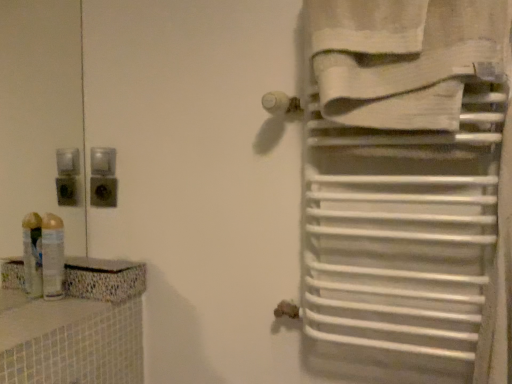
What do you see at coordinates (53, 256) in the screenshot?
I see `translucent plastic spray can at left` at bounding box center [53, 256].

Where is `white cotton towel at upper right`? white cotton towel at upper right is located at coordinates (401, 58).

Is translucent plastic spray can at left turned away from black plastic outlet at upper left?

No.

From a real-world perspective, is translucent plastic spray can at left positioned above or below black plastic outlet at upper left?

In terms of real-world spatial position, translucent plastic spray can at left is below black plastic outlet at upper left.

From the image's perspective, does translucent plastic spray can at left appear higher than black plastic outlet at upper left?

No, from the image's perspective, translucent plastic spray can at left is not over black plastic outlet at upper left.

From the image's perspective, is white cotton towel at upper right located above or below black plastic outlet at upper left?

Based on their image positions, white cotton towel at upper right is located above black plastic outlet at upper left.

Which is behind, white cotton towel at upper right or black plastic outlet at upper left?

black plastic outlet at upper left is further away from the camera.

What's the angular difference between white cotton towel at upper right and black plastic outlet at upper left's facing directions?

They differ by 0.102 degrees in their facing directions.

Looking at their sizes, would you say white cotton towel at upper right is wider or thinner than black plastic outlet at upper left?

Considering their sizes, white cotton towel at upper right looks broader than black plastic outlet at upper left.

Which is behind, point (112, 183) or point (63, 253)?

The point (112, 183) is farther from the camera.

From the image's perspective, is black plastic outlet at upper left beneath translucent plastic spray can at left?

Incorrect, from the image's perspective, black plastic outlet at upper left is higher than translucent plastic spray can at left.

Which object is positioned more to the right, black plastic outlet at upper left or translucent plastic spray can at left?

From the viewer's perspective, black plastic outlet at upper left appears more on the right side.

Is white cotton towel at upper right inside translucent plastic spray can at left?

Actually, white cotton towel at upper right is outside translucent plastic spray can at left.

From a real-world perspective, is translucent plastic spray can at left below white cotton towel at upper right?

Yes, from a real-world perspective, translucent plastic spray can at left is below white cotton towel at upper right.

Considering the positions of points (47, 261) and (417, 10), is point (47, 261) closer to camera compared to point (417, 10)?

No, it is not.

At what (x,y) coordinates should I click in order to perform the action: click on towel in front of the translucent plastic spray can at left. Please return your answer as a coordinate pair (x, y). This screenshot has height=384, width=512. Looking at the image, I should click on (401, 58).

From a real-world perspective, between black plastic outlet at upper left and white cotton towel at upper right, who is vertically lower?

black plastic outlet at upper left.

Is black plastic outlet at upper left wider than white cotton towel at upper right?

In fact, black plastic outlet at upper left might be narrower than white cotton towel at upper right.

Considering the relative positions of black plastic outlet at upper left and white cotton towel at upper right in the image provided, is black plastic outlet at upper left to the right of white cotton towel at upper right from the viewer's perspective?

In fact, black plastic outlet at upper left is to the left of white cotton towel at upper right.

Considering the positions of objects black plastic outlet at upper left and white cotton towel at upper right in the image provided, who is behind, black plastic outlet at upper left or white cotton towel at upper right?

black plastic outlet at upper left is further from the camera.

Find the location of `toiletry behind the white cotton towel at upper right`. toiletry behind the white cotton towel at upper right is located at coordinates 53,256.

Which is more to the right, white cotton towel at upper right or translucent plastic spray can at left?

Positioned to the right is white cotton towel at upper right.

Does white cotton towel at upper right lie behind translucent plastic spray can at left?

No, white cotton towel at upper right is closer to the viewer.

Identify the location of toiletry below the black plastic outlet at upper left (from the image's perspective). The image size is (512, 384). (53, 256).

The image size is (512, 384). Find the location of `towel that appears in front of the black plastic outlet at upper left`. towel that appears in front of the black plastic outlet at upper left is located at coordinates (401, 58).

When comparing their distances from translucent plastic spray can at left, does white cotton towel at upper right or black plastic outlet at upper left seem further?

white cotton towel at upper right lies further to translucent plastic spray can at left than the other object.

Consider the image. When comparing their distances from white cotton towel at upper right, does black plastic outlet at upper left or translucent plastic spray can at left seem further?

translucent plastic spray can at left lies further to white cotton towel at upper right than the other object.

From the image, which object appears to be farther from black plastic outlet at upper left, translucent plastic spray can at left or white cotton towel at upper right?

The object further to black plastic outlet at upper left is white cotton towel at upper right.

Looking at the image, which one is located further to translucent plastic spray can at left, black plastic outlet at upper left or white cotton towel at upper right?

white cotton towel at upper right.

When comparing their distances from white cotton towel at upper right, does translucent plastic spray can at left or black plastic outlet at upper left seem closer?

black plastic outlet at upper left is positioned closer to the anchor white cotton towel at upper right.

From the picture: When comparing their distances from black plastic outlet at upper left, does white cotton towel at upper right or translucent plastic spray can at left seem further?

Among the two, white cotton towel at upper right is located further to black plastic outlet at upper left.

Where is `electric outlet between translucent plastic spray can at left and white cotton towel at upper right in the horizontal direction`? This screenshot has height=384, width=512. electric outlet between translucent plastic spray can at left and white cotton towel at upper right in the horizontal direction is located at coordinates (103, 191).